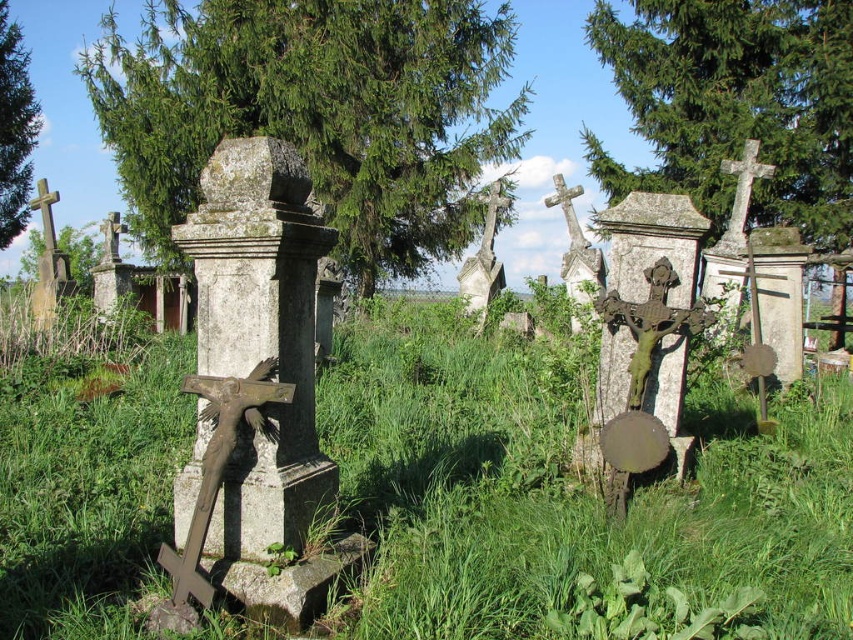
You are a surveyor trying to locate the white stone cross at upper right in a cemetery. Using a coordinate system where the bottom left corner is the origin, can you determine its location?

The white stone cross at upper right is located at coordinates point (741, 189).

You are standing at the entrance of the cemetery and want to take a photo of both the white stone cross at upper right and the stone cross at center. Which cross should you position closer to the camera to include both in the frame?

To include both crosses in the frame, position the white stone cross at upper right closer to the camera since it is already in front of the stone cross at center.

You are standing in the cemetery and want to walk from the stone cross at center to the white stone cross at upper right. Which direction should you head?

You should head to the right because the white stone cross at upper right is located to the right of the stone cross at center.